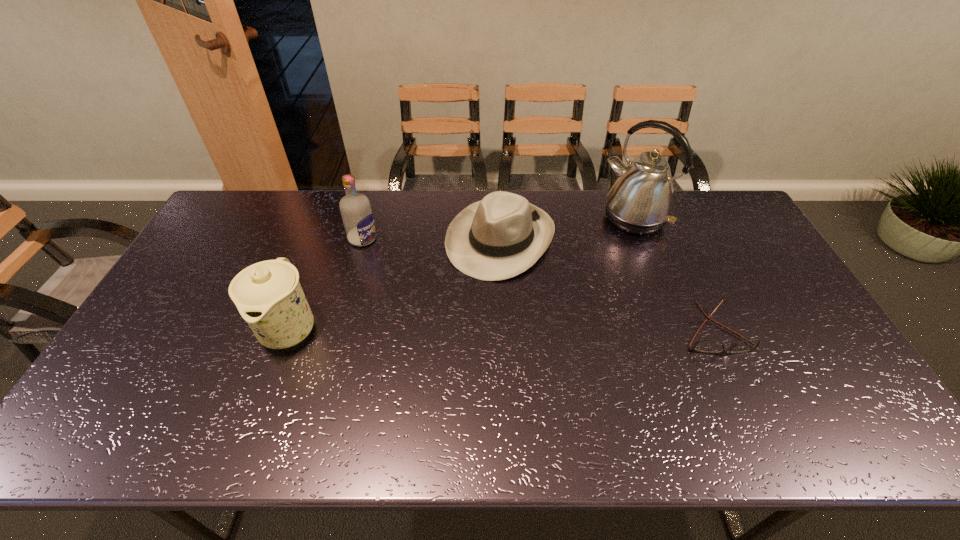
Locate an element on the screen. This screenshot has height=540, width=960. free space between the chinaware and the second shortest object is located at coordinates (395, 284).

This screenshot has height=540, width=960. In order to click on free space between the fourth tallest object and the shortest object in this screenshot , I will do `click(608, 286)`.

Identify the location of unoccupied area between the leftmost object and the kettle. (462, 273).

You are a GUI agent. You are given a task and a screenshot of the screen. Output one action in this format:
    pyautogui.click(x=<x>, y=<y>)
    Task: Click on the object that is the third closest to the shortest object
    The height and width of the screenshot is (540, 960).
    Given the screenshot: What is the action you would take?
    pyautogui.click(x=355, y=208)

Where is `object that is the third nearest to the third object from left to right`? The width and height of the screenshot is (960, 540). object that is the third nearest to the third object from left to right is located at coordinates (712, 346).